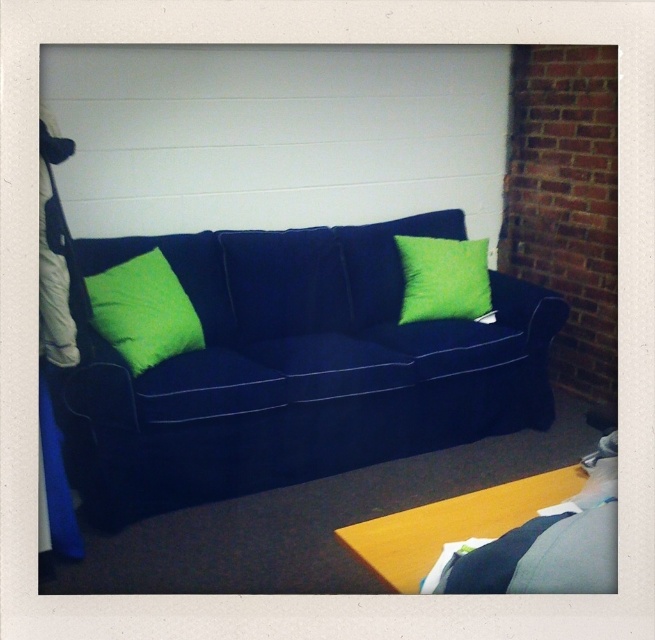
Question: Based on their relative distances, which object is farther from the lime green fabric pillow at center?

Choices:
 (A) lime green fabric pillow at left
 (B) velvet dark blue couch at center

Answer: (A)

Question: Among these objects, which one is farthest from the camera?

Choices:
 (A) lime green fabric pillow at center
 (B) velvet dark blue couch at center

Answer: (A)

Question: Which point is closer to the camera?

Choices:
 (A) velvet dark blue couch at center
 (B) lime green fabric pillow at center

Answer: (A)

Question: Can you confirm if velvet dark blue couch at center is positioned above lime green fabric pillow at left?

Choices:
 (A) yes
 (B) no

Answer: (B)

Question: In this image, where is lime green fabric pillow at left located relative to lime green fabric pillow at center?

Choices:
 (A) above
 (B) below

Answer: (B)

Question: Can you confirm if velvet dark blue couch at center is positioned to the right of lime green fabric pillow at left?

Choices:
 (A) no
 (B) yes

Answer: (B)